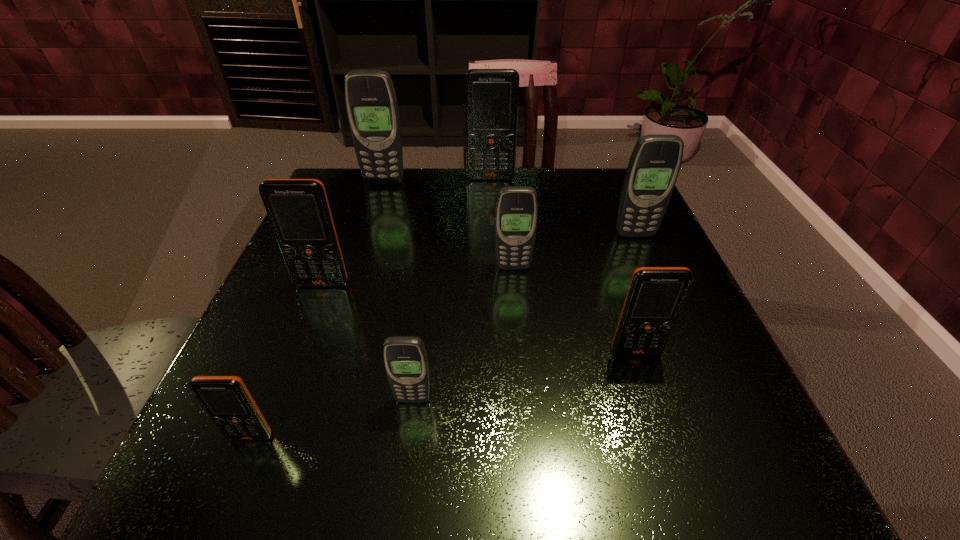
Locate an element on the screen. free space located on the screen of the second smallest gray cellular telephone is located at coordinates (525, 404).

Locate an element on the screen. The width and height of the screenshot is (960, 540). free space located 0.210m on the screen of the sixth farthest cellular telephone is located at coordinates (681, 491).

Find the location of a particular element. The width and height of the screenshot is (960, 540). free space located on the screen of the second gray cellular telephone from left to right is located at coordinates (406, 449).

Locate an element on the screen. This screenshot has height=540, width=960. object that is at the near edge is located at coordinates (226, 399).

This screenshot has height=540, width=960. Identify the location of object positioned at the far left corner. (371, 103).

At what (x,y) coordinates should I click in order to perform the action: click on object that is at the near left corner. Please return your answer as a coordinate pair (x, y). The height and width of the screenshot is (540, 960). Looking at the image, I should click on (226, 399).

The width and height of the screenshot is (960, 540). In the image, there is a desktop. Find the location of `vacant space at the far edge`. vacant space at the far edge is located at coordinates (487, 190).

In the image, there is a desktop. Where is `free space at the near edge`? The image size is (960, 540). free space at the near edge is located at coordinates (496, 435).

At what (x,y) coordinates should I click in order to perform the action: click on vacant space at the right edge of the desktop. Please return your answer as a coordinate pair (x, y). Looking at the image, I should click on (611, 241).

In the image, there is a desktop. Where is `free space at the far left corner`? The height and width of the screenshot is (540, 960). free space at the far left corner is located at coordinates (377, 214).